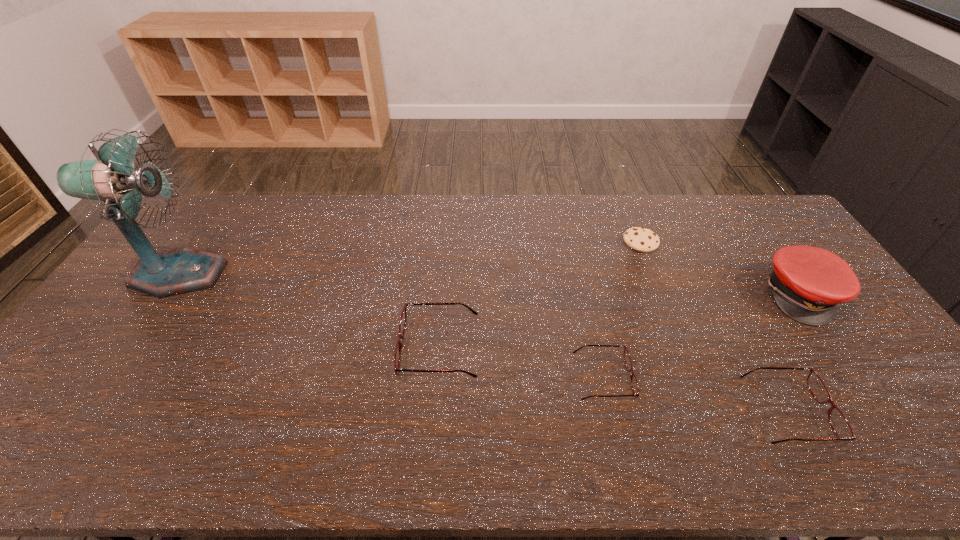
Find the location of a particular element. The width and height of the screenshot is (960, 540). free point that keeps the spectacless evenly spaced on the left is located at coordinates (292, 321).